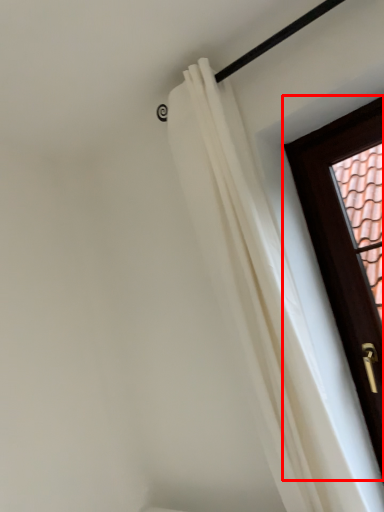
Question: From the image's perspective, where is door (annotated by the red box) located relative to curtain?

Choices:
 (A) above
 (B) below

Answer: (B)